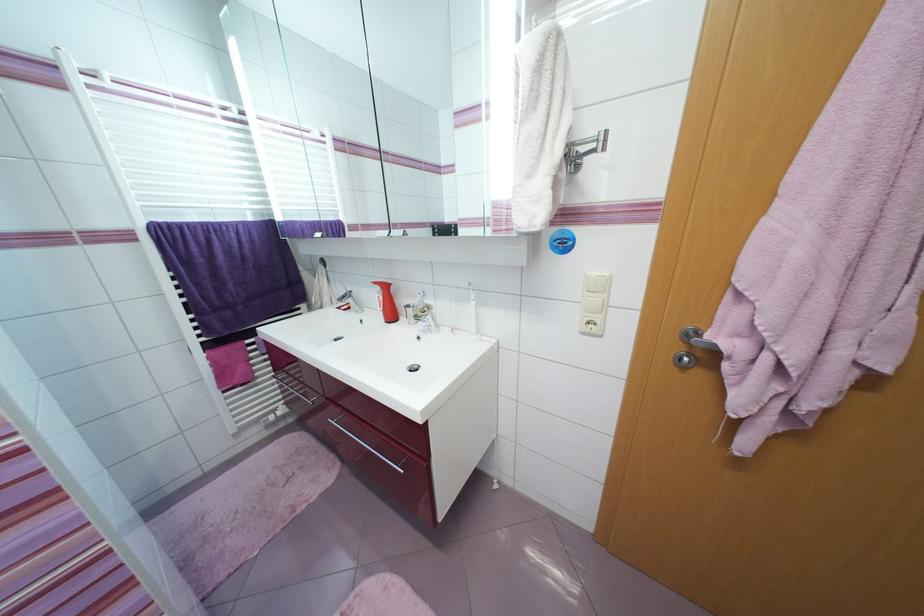
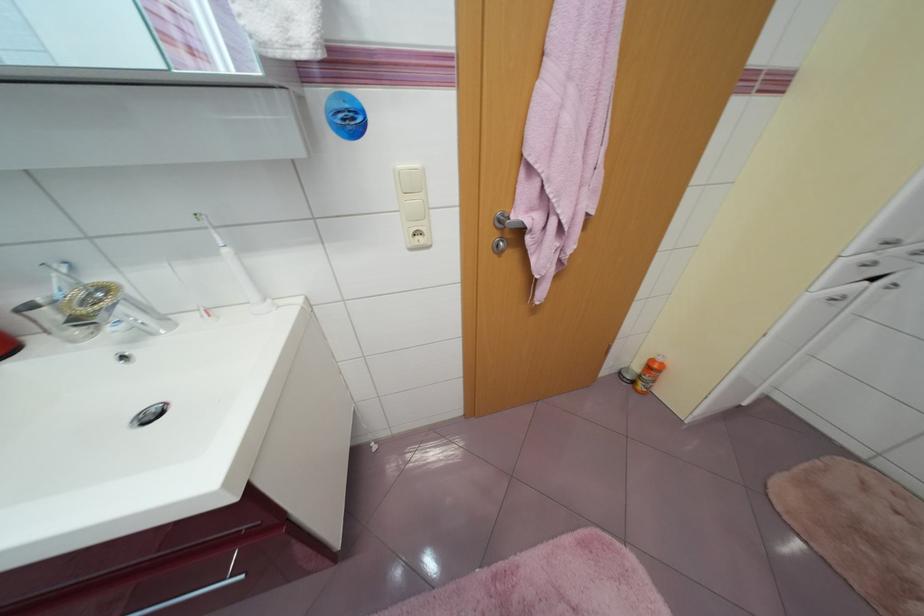
The point at (433, 309) is marked in the first image. Where is the corresponding point in the second image?

(112, 291)